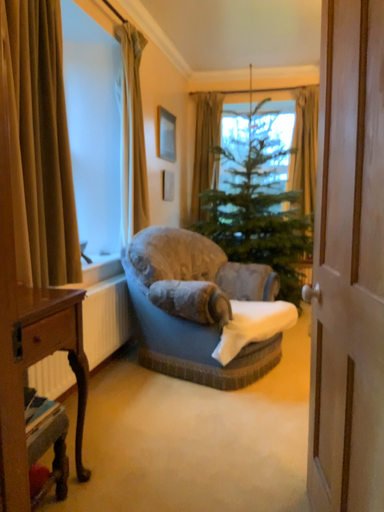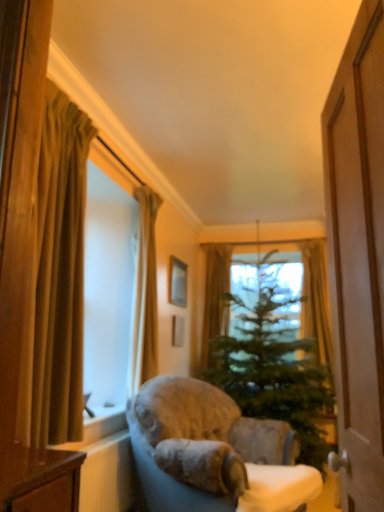
Question: How did the camera likely rotate when shooting the video?

Choices:
 (A) rotated downward
 (B) rotated upward

Answer: (B)